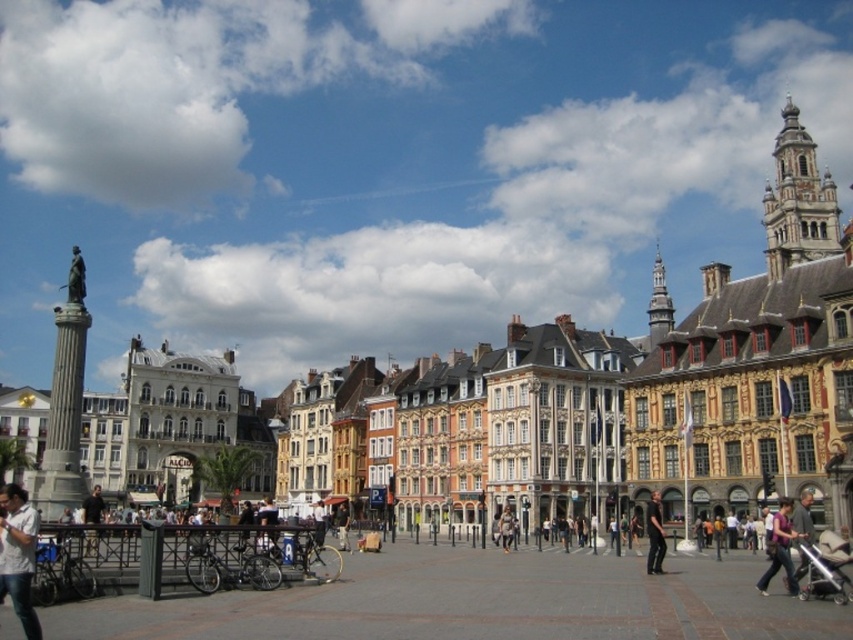
You are a photographer standing in the urban square and want to capture both the matte stone statue at left and the matte purple shirt at center in a single shot. Which object will appear wider in your photo?

The matte stone statue at left will appear wider in the photo because its width is larger than the matte purple shirt at center.

Consider the image. You are a photographer standing in the urban square and want to capture both the matte purple shirt at center and the dark gray fabric jacket at lower right in the same frame. Which object should you focus on first to ensure both are in the shot?

The matte purple shirt at center is much taller than the dark gray fabric jacket at lower right, so you should focus on the matte purple shirt at center first to ensure both are in the shot.